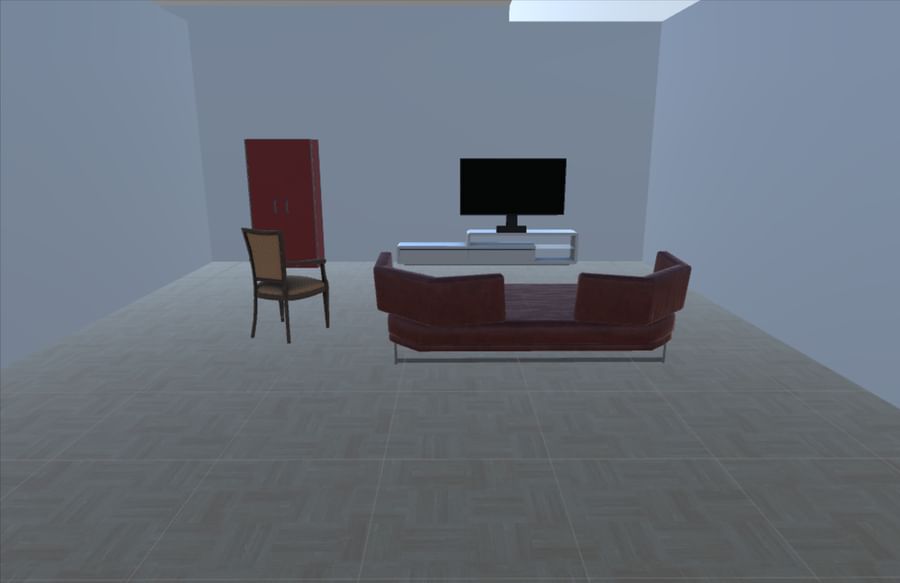
In order to click on back support in this screenshot , I will do `click(669, 294)`, `click(416, 285)`.